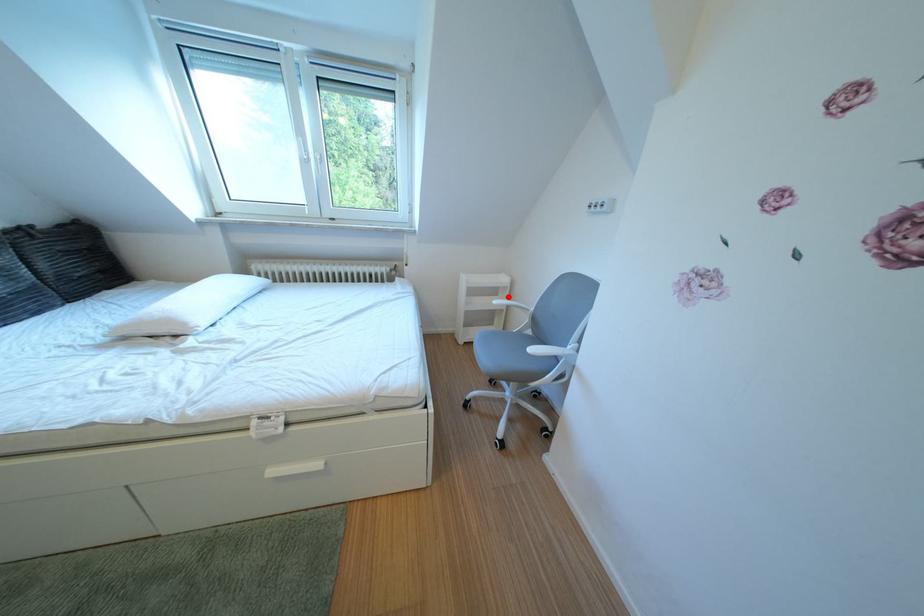
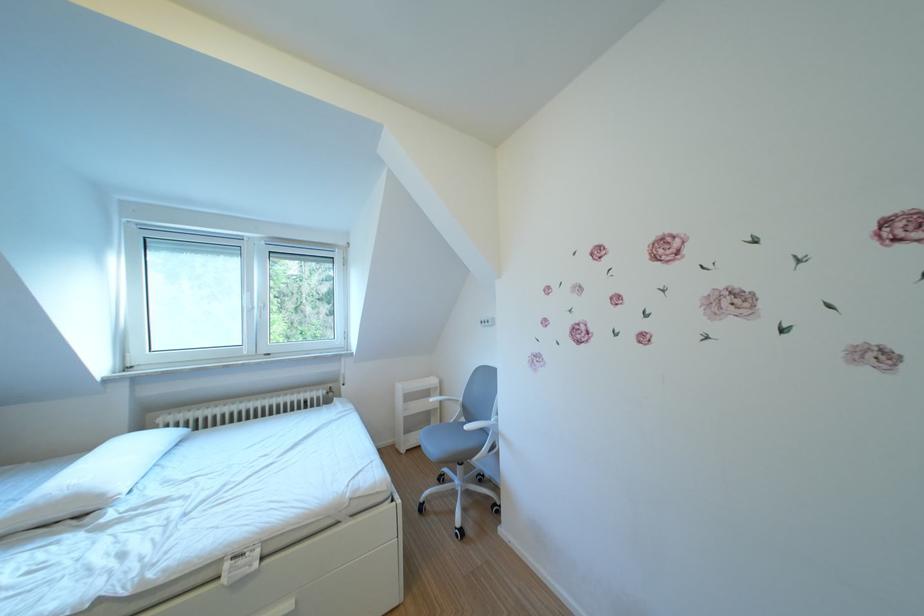
Question: A red point is marked in image1. In image2, is the corresponding 3D point closer to the camera or farther? Reply with the corresponding letter.

Choices:
 (A) The corresponding 3D point is closer.
 (B) The corresponding 3D point is farther.

Answer: (B)